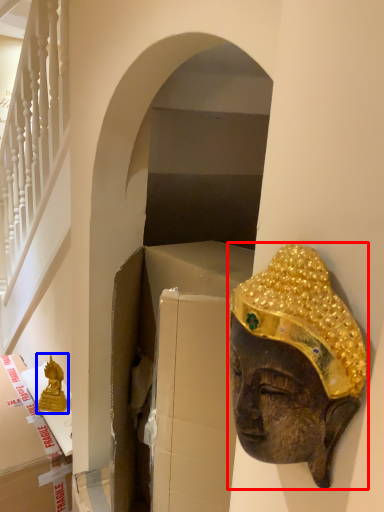
Question: Which of the following is the closest to the observer, person (highlighted by a red box) or statue (highlighted by a blue box)?

Choices:
 (A) person
 (B) statue

Answer: (A)